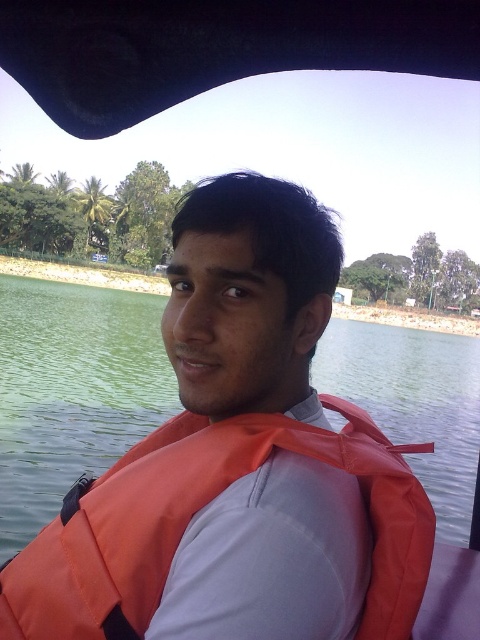
Between green water at center and orange fabric life jacket at center, which one has less height?

orange fabric life jacket at center is shorter.

Can you confirm if green water at center is wider than orange fabric life jacket at center?

Indeed, green water at center has a greater width compared to orange fabric life jacket at center.

The height and width of the screenshot is (640, 480). In order to click on green water at center in this screenshot , I will do `click(72, 392)`.